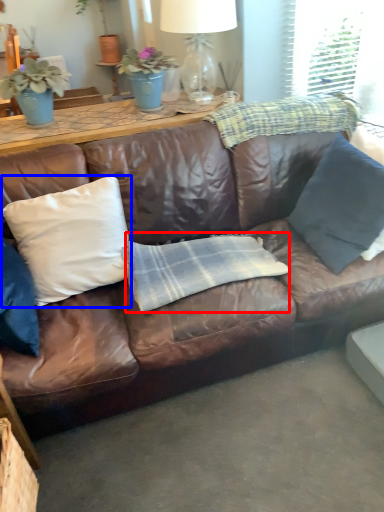
Question: Which object appears farthest to the camera in this image, plaid (highlighted by a red box) or pillow (highlighted by a blue box)?

Choices:
 (A) plaid
 (B) pillow

Answer: (A)